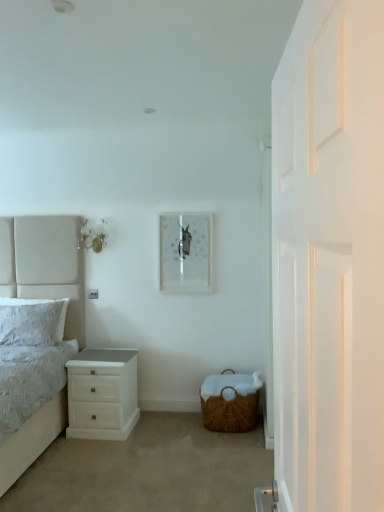
Question: Considering the positions of white glossy chest of drawers at lower left and matte white picture frame at center in the image, is white glossy chest of drawers at lower left taller or shorter than matte white picture frame at center?

Choices:
 (A) tall
 (B) short

Answer: (B)

Question: From a real-world perspective, is white glossy chest of drawers at lower left above or below matte white picture frame at center?

Choices:
 (A) below
 (B) above

Answer: (A)

Question: Which is nearer to the white wooden door at right?

Choices:
 (A) white fabric bed at left
 (B) white textured pillow at left
 (C) matte white picture frame at center
 (D) woven brown basket at lower right
 (E) white glossy chest of drawers at lower left

Answer: (D)

Question: Which of these objects is positioned farthest from the matte white picture frame at center?

Choices:
 (A) white textured pillow at left
 (B) white wooden door at right
 (C) white fabric bed at left
 (D) woven brown basket at lower right
 (E) white glossy chest of drawers at lower left

Answer: (B)